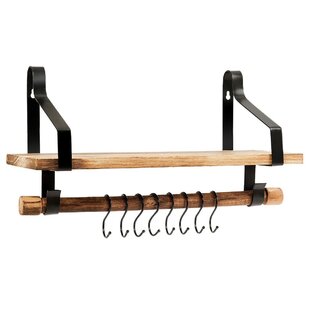
Identify the location of 4th black hook. This screenshot has width=310, height=310. (153, 237).